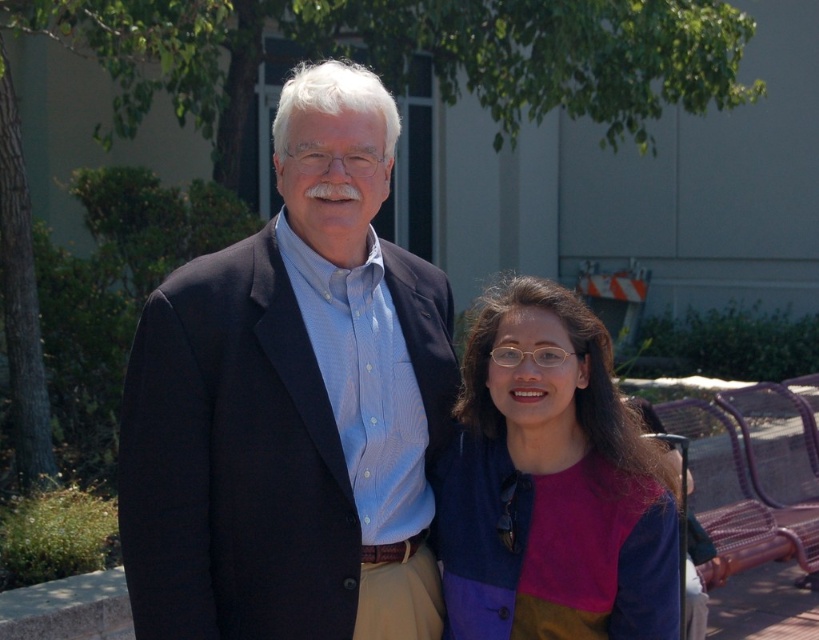
Question: Which of the following is the farthest from the observer?

Choices:
 (A) multicolored fabric jacket at center
 (B) matte black suit at center

Answer: (A)

Question: Can you confirm if matte black suit at center is positioned above multicolored fabric jacket at center?

Choices:
 (A) yes
 (B) no

Answer: (A)

Question: Can you confirm if matte black suit at center is wider than multicolored fabric jacket at center?

Choices:
 (A) no
 (B) yes

Answer: (B)

Question: Which object appears farthest from the camera in this image?

Choices:
 (A) multicolored fabric jacket at center
 (B) matte black suit at center

Answer: (A)

Question: Does matte black suit at center have a greater width compared to multicolored fabric jacket at center?

Choices:
 (A) no
 (B) yes

Answer: (B)